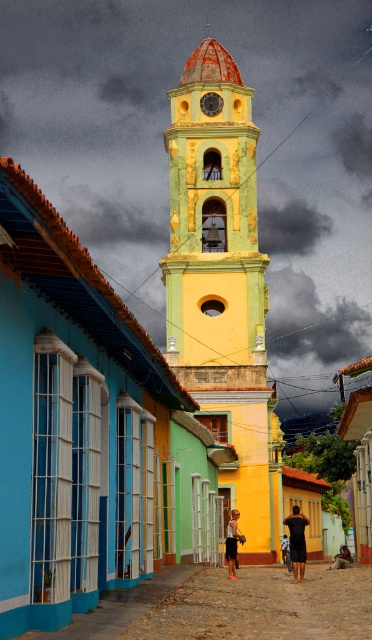
Question: Is yellow matte bell tower at center closer to the viewer compared to dark brown leather sandals at lower center?

Choices:
 (A) yes
 (B) no

Answer: (B)

Question: Which point is closer to the camera taking this photo?

Choices:
 (A) (212, 112)
 (B) (283, 554)
 (C) (341, 566)
 (D) (226, 541)

Answer: (D)

Question: From the image, what is the correct spatial relationship of cobblestone street at center in relation to dark brown leather sandals at lower center?

Choices:
 (A) above
 (B) below

Answer: (B)

Question: Which of these objects is positioned closest to the yellow matte bell tower at center?

Choices:
 (A) cobblestone street at center
 (B) dark skin human at center

Answer: (B)

Question: Can you confirm if dark brown leather sandals at lower center is positioned to the left of dark brown leather bag at center?

Choices:
 (A) yes
 (B) no

Answer: (A)

Question: Which object appears closest to the camera in this image?

Choices:
 (A) metallic clock face at center
 (B) dark brown leather bag at center

Answer: (B)